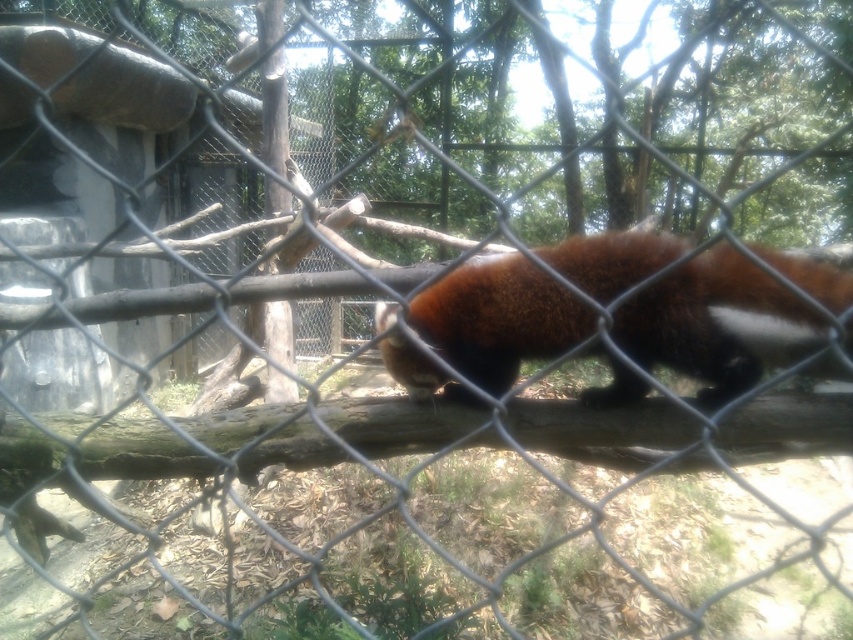
Question: Can you confirm if fuzzy brown fur at center is positioned to the left of brown rough wood at center?

Choices:
 (A) no
 (B) yes

Answer: (A)

Question: Does fuzzy brown fur at center have a greater width compared to brown rough wood at center?

Choices:
 (A) no
 (B) yes

Answer: (A)

Question: From the image, what is the correct spatial relationship of fuzzy brown fur at center in relation to brown rough wood at center?

Choices:
 (A) right
 (B) left

Answer: (A)

Question: Which of the following is the closest to the observer?

Choices:
 (A) (355, 397)
 (B) (630, 298)

Answer: (B)

Question: Which point is closer to the camera?

Choices:
 (A) brown rough wood at center
 (B) fuzzy brown fur at center

Answer: (B)